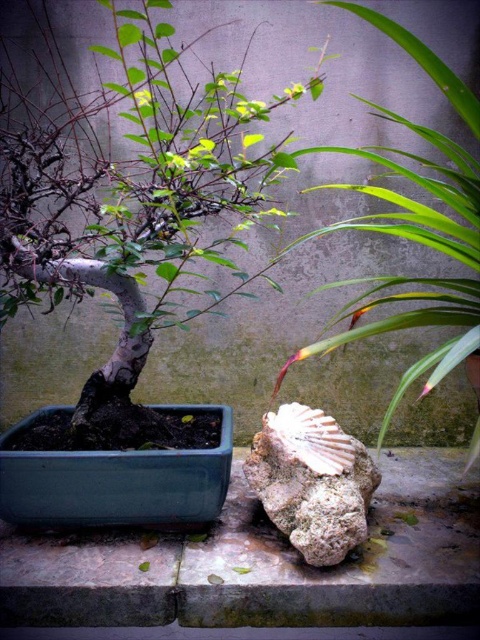
You are standing in a garden and want to take a photo of the matte gray bonsai at left. If your camera has a minimum focus distance of 1 meter, will you be able to focus on the bonsai from your current position?

The matte gray bonsai at left and camera are 1.08 meters apart. Since the minimum focus distance is 1 meter, the camera can focus on the bonsai as the distance is slightly more than required.

You are standing in front of the garden scene and want to touch both the green leafy plant at center and the rough textured stone at center. Which object should you reach for first to touch the one closer to you?

You should reach for the green leafy plant at center first because it is closer to the viewer than the rough textured stone at center.